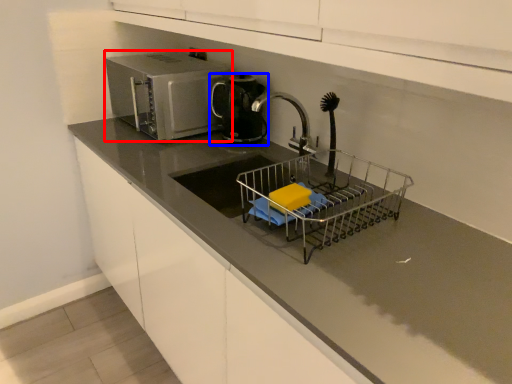
Question: Which point is further to the camera, home appliance (highlighted by a red box) or kitchen appliance (highlighted by a blue box)?

Choices:
 (A) home appliance
 (B) kitchen appliance

Answer: (B)